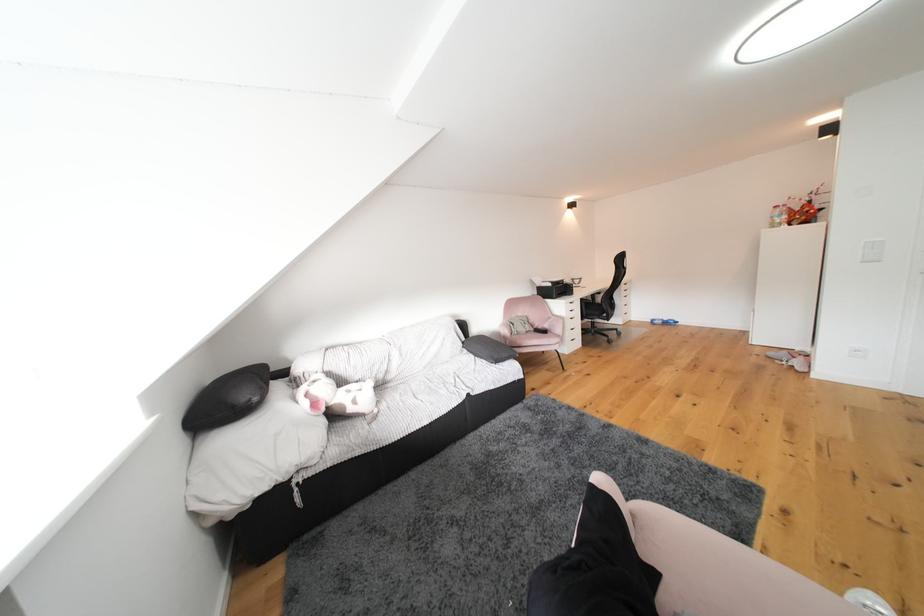
This screenshot has width=924, height=616. I want to click on black pillow, so click(x=226, y=399).